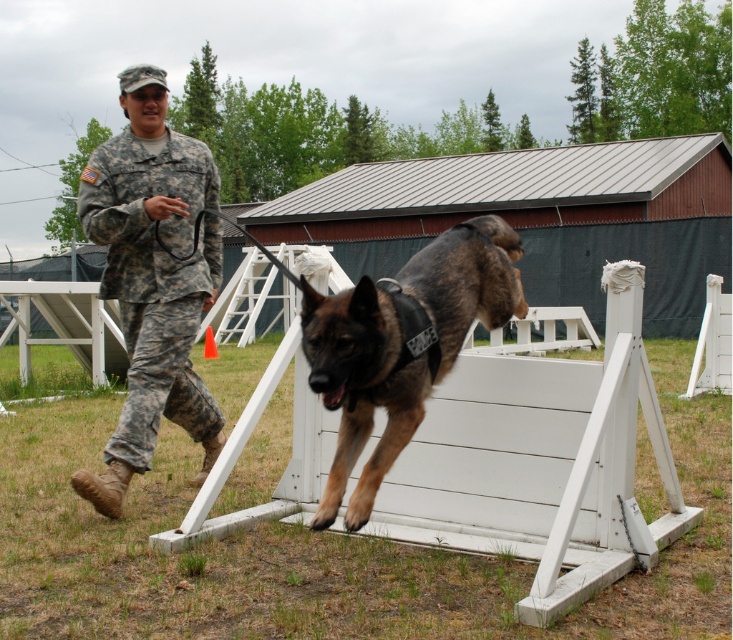
You are a photographer trying to capture a photo of the brindle fur dog at center and the camouflage uniform at left. Since you want both subjects to be in the frame, which direction should you move your camera to ensure both are visible?

The camouflage uniform at left is positioned on the left side of the brindle fur dog at center, so you should move your camera to the left to include both the camouflage uniform at left and the brindle fur dog at center in the frame.

You are a drone operator assigned to capture aerial footage of the military training exercise. The drone must maintain a minimum altitude of 4 meters to avoid interfering with the exercise. If the white wood hurdle at center is the main focus, will the drone be able to hover above it at the required altitude while still capturing clear footage?

The distance between the white wood hurdle at center and the camera is 3.68 meters. Since the drone needs to maintain a minimum altitude of 4 meters, it cannot hover at the required height while still being close enough to capture clear footage of the hurdle.

You are a military trainer observing the scene. The handler is walking the brindle fur dog at center and wants to ensure the dog can clear the white wood hurdle at center. From the dog current position, which direction should the dog move to approach the hurdle?

The white wood hurdle at center is to the right of the brindle fur dog at center, so the dog should move to the right to approach the hurdle.